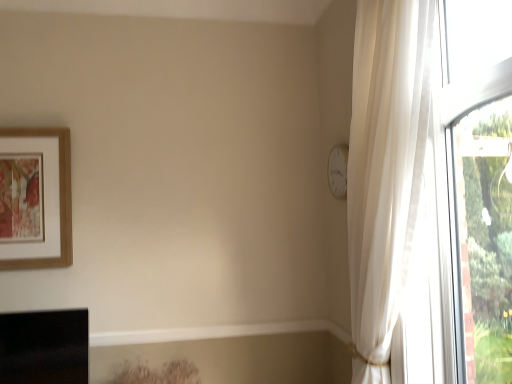
Describe the element at coordinates (338, 171) in the screenshot. The width and height of the screenshot is (512, 384). I see `white matte clock at upper right` at that location.

Locate an element on the screen. white matte clock at upper right is located at coordinates (338, 171).

In order to face white matte clock at upper right, should I rotate leftwards or rightwards?

You should look right and rotate roughly 11.108 degrees.

What do you see at coordinates (59, 198) in the screenshot? I see `wooden-framed artwork at upper left` at bounding box center [59, 198].

Where is `wooden-framed artwork at upper left`? The width and height of the screenshot is (512, 384). wooden-framed artwork at upper left is located at coordinates (59, 198).

Where is `white matte clock at upper right`? white matte clock at upper right is located at coordinates (338, 171).

Which is more to the left, wooden-framed artwork at upper left or white matte clock at upper right?

wooden-framed artwork at upper left is more to the left.

Is the position of wooden-framed artwork at upper left less distant than that of white matte clock at upper right?

No, wooden-framed artwork at upper left is further to the viewer.

Considering the positions of point (3, 135) and point (345, 161), is point (3, 135) closer or farther from the camera than point (345, 161)?

Clearly, point (3, 135) is more distant from the camera than point (345, 161).

From the image's perspective, would you say wooden-framed artwork at upper left is shown under white matte clock at upper right?

Yes, from the image's perspective, wooden-framed artwork at upper left is beneath white matte clock at upper right.

From a real-world perspective, does wooden-framed artwork at upper left stand above white matte clock at upper right?

No, from a real-world perspective, wooden-framed artwork at upper left is not over white matte clock at upper right

Considering the relative sizes of wooden-framed artwork at upper left and white matte clock at upper right in the image provided, is wooden-framed artwork at upper left wider than white matte clock at upper right?

Correct, the width of wooden-framed artwork at upper left exceeds that of white matte clock at upper right.

Can you confirm if wooden-framed artwork at upper left is taller than white matte clock at upper right?

Indeed, wooden-framed artwork at upper left has a greater height compared to white matte clock at upper right.

In the scene shown: Considering the sizes of objects wooden-framed artwork at upper left and white matte clock at upper right in the image provided, who is bigger, wooden-framed artwork at upper left or white matte clock at upper right?

Bigger between the two is wooden-framed artwork at upper left.

Is white matte clock at upper right located within wooden-framed artwork at upper left?

No, white matte clock at upper right is located outside of wooden-framed artwork at upper left.

Are wooden-framed artwork at upper left and white matte clock at upper right located far from each other?

Yes, wooden-framed artwork at upper left is far from white matte clock at upper right.

Is wooden-framed artwork at upper left facing away from white matte clock at upper right?

wooden-framed artwork at upper left is not turned away from white matte clock at upper right.

How many degrees apart are the facing directions of wooden-framed artwork at upper left and white matte clock at upper right?

wooden-framed artwork at upper left and white matte clock at upper right are facing 89.8 degrees away from each other.

How far apart are wooden-framed artwork at upper left and white matte clock at upper right?

wooden-framed artwork at upper left and white matte clock at upper right are 1.33 meters apart.

The image size is (512, 384). I want to click on picture frame that is below the white matte clock at upper right (from the image's perspective), so click(59, 198).

Can you confirm if white matte clock at upper right is positioned to the left of wooden-framed artwork at upper left?

No.

In the image, is white matte clock at upper right positioned in front of or behind wooden-framed artwork at upper left?

white matte clock at upper right is positioned closer to the viewer than wooden-framed artwork at upper left.

Considering the points (343, 144) and (65, 142), which point is in front, point (343, 144) or point (65, 142)?

Point (343, 144)

From the image's perspective, which object appears higher, white matte clock at upper right or wooden-framed artwork at upper left?

From the image's view, white matte clock at upper right is above.

From a real-world perspective, is white matte clock at upper right above or below wooden-framed artwork at upper left?

white matte clock at upper right is situated higher than wooden-framed artwork at upper left in the real world.

Can you confirm if white matte clock at upper right is wider than wooden-framed artwork at upper left?

In fact, white matte clock at upper right might be narrower than wooden-framed artwork at upper left.

From their relative heights in the image, would you say white matte clock at upper right is taller or shorter than wooden-framed artwork at upper left?

Clearly, white matte clock at upper right is shorter compared to wooden-framed artwork at upper left.

Consider the image. Is white matte clock at upper right bigger than wooden-framed artwork at upper left?

Actually, white matte clock at upper right might be smaller than wooden-framed artwork at upper left.

Can we say white matte clock at upper right lies outside wooden-framed artwork at upper left?

That's correct, white matte clock at upper right is outside of wooden-framed artwork at upper left.

Is white matte clock at upper right far away from wooden-framed artwork at upper left?

Yes, white matte clock at upper right and wooden-framed artwork at upper left are quite far apart.

Is wooden-framed artwork at upper left at the back of white matte clock at upper right?

No, white matte clock at upper right is not facing the opposite direction of wooden-framed artwork at upper left.

How different are the orientations of white matte clock at upper right and wooden-framed artwork at upper left in degrees?

There is a 89.8-degree angle between the facing directions of white matte clock at upper right and wooden-framed artwork at upper left.

How far apart are white matte clock at upper right and wooden-framed artwork at upper left?

1.33 meters.

Where is `picture frame below the white matte clock at upper right (from a real-world perspective)`? This screenshot has height=384, width=512. picture frame below the white matte clock at upper right (from a real-world perspective) is located at coordinates (59, 198).

Identify the location of clock positioned vertically above the wooden-framed artwork at upper left (from a real-world perspective). (338, 171).

Identify the location of picture frame that appears on the left of white matte clock at upper right. [59, 198].